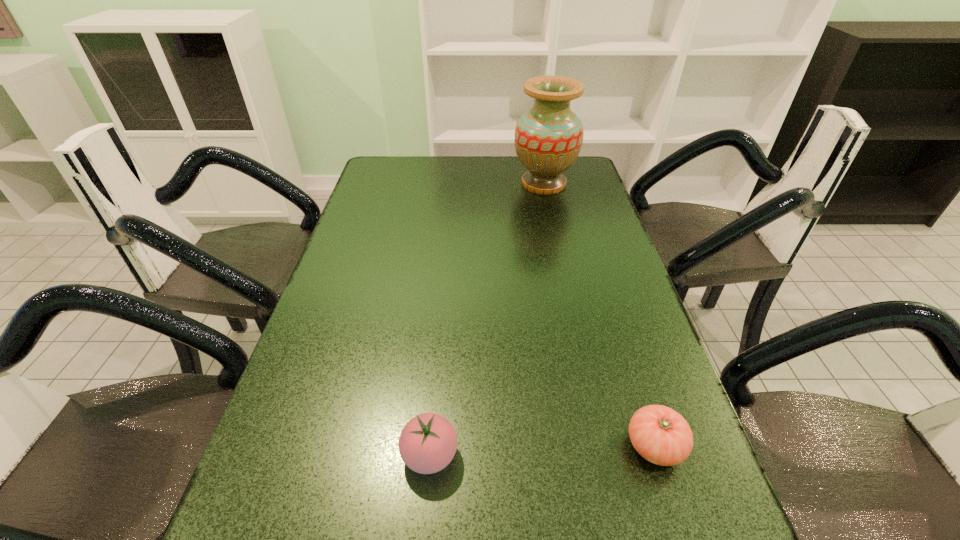
Identify the location of free point that satisfies the following two spatial constraints: 1. on the back side of the right tomato; 2. on the right side of the left tomato. (431, 446).